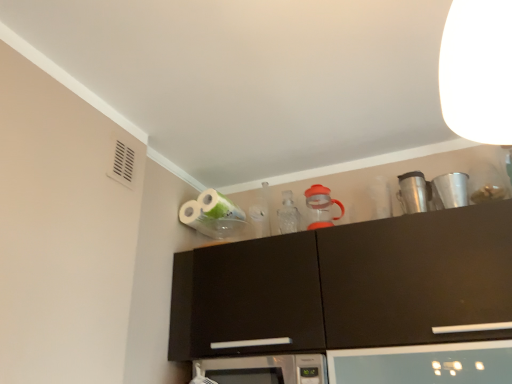
Question: Can shiny metallic coffee cup at upper right, positioned as the 2th appliance in right-to-left order, be found inside orange plastic pitcher at upper center, the 3th appliance viewed from the right?

Choices:
 (A) no
 (B) yes

Answer: (A)

Question: Can you confirm if orange plastic pitcher at upper center, which is the first appliance in left-to-right order, is positioned to the right of shiny metallic coffee cup at upper right, positioned as the 2th appliance in right-to-left order?

Choices:
 (A) no
 (B) yes

Answer: (A)

Question: Is the depth of orange plastic pitcher at upper center, the 3th appliance viewed from the right, less than that of shiny metallic coffee cup at upper right, positioned as the 2th appliance in right-to-left order?

Choices:
 (A) yes
 (B) no

Answer: (B)

Question: Is orange plastic pitcher at upper center, which is the first appliance in left-to-right order, positioned beyond the bounds of shiny metallic coffee cup at upper right, the 2th appliance in the left-to-right sequence?

Choices:
 (A) yes
 (B) no

Answer: (A)

Question: From a real-world perspective, is orange plastic pitcher at upper center, the 3th appliance viewed from the right, beneath shiny metallic coffee cup at upper right, positioned as the 2th appliance in right-to-left order?

Choices:
 (A) yes
 (B) no

Answer: (B)

Question: Does point (265, 370) appear closer or farther from the camera than point (318, 205)?

Choices:
 (A) farther
 (B) closer

Answer: (B)

Question: From the image's perspective, is silver metallic microwave at center above or below orange plastic pitcher at upper center, which is the first appliance in left-to-right order?

Choices:
 (A) above
 (B) below

Answer: (B)

Question: From a real-world perspective, is silver metallic microwave at center physically located above or below orange plastic pitcher at upper center, the 3th appliance viewed from the right?

Choices:
 (A) below
 (B) above

Answer: (A)

Question: In the image, is silver metallic microwave at center positioned in front of or behind orange plastic pitcher at upper center, the 3th appliance viewed from the right?

Choices:
 (A) front
 (B) behind

Answer: (A)

Question: Is white glossy toilet paper at upper center taller or shorter than metallic silver cup at upper right, acting as the third appliance starting from the left?

Choices:
 (A) tall
 (B) short

Answer: (A)

Question: Choose the correct answer: Is white glossy toilet paper at upper center inside metallic silver cup at upper right, acting as the third appliance starting from the left, or outside it?

Choices:
 (A) outside
 (B) inside

Answer: (A)

Question: Considering their positions, is white glossy toilet paper at upper center located in front of or behind metallic silver cup at upper right, the 1th appliance when ordered from right to left?

Choices:
 (A) behind
 (B) front

Answer: (A)

Question: From the image's perspective, is white glossy toilet paper at upper center located above or below metallic silver cup at upper right, the 1th appliance when ordered from right to left?

Choices:
 (A) above
 (B) below

Answer: (B)

Question: In the image, is white glossy toilet paper at upper center positioned in front of or behind silver metallic microwave at center?

Choices:
 (A) behind
 (B) front

Answer: (A)

Question: Visually, is white glossy toilet paper at upper center positioned to the left or to the right of silver metallic microwave at center?

Choices:
 (A) right
 (B) left

Answer: (B)